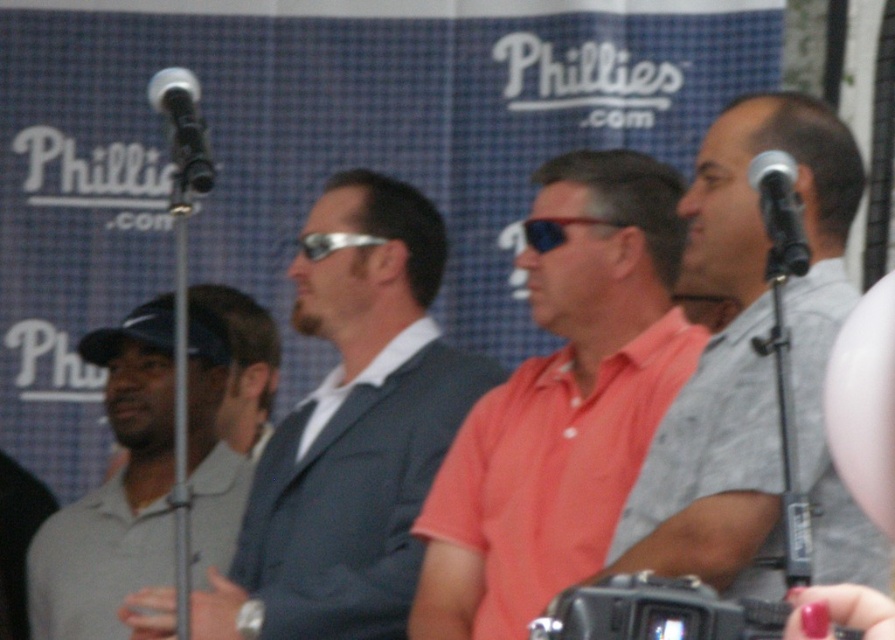
Question: Which object is closer to the camera taking this photo?

Choices:
 (A) matte gray suit at center
 (B) black plastic camera at lower center
 (C) silver metallic microphone at upper right

Answer: (B)

Question: Which is nearer to the sunglasses at center?

Choices:
 (A) black plastic camera at lower center
 (B) silver metallic microphone at upper right
 (C) matte orange shirt at center

Answer: (C)

Question: From the image, what is the correct spatial relationship of gray polo shirt at left in relation to gray fabric cap at left?

Choices:
 (A) right
 (B) left

Answer: (B)

Question: Which point is closer to the camera?

Choices:
 (A) gray fabric cap at left
 (B) matte gray suit at center

Answer: (B)

Question: Is gray polo shirt at left below silver metallic microphone at upper left?

Choices:
 (A) no
 (B) yes

Answer: (B)

Question: Considering the relative positions of gray polo shirt at left and black plastic camera at lower center in the image provided, where is gray polo shirt at left located with respect to black plastic camera at lower center?

Choices:
 (A) above
 (B) below

Answer: (A)